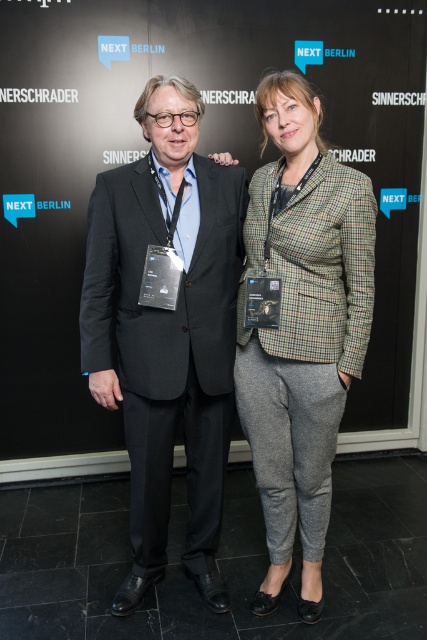
Based on the photo, who is higher up, dark gray suit at center or plaid wool blazer at center?

plaid wool blazer at center is above.

Is point (222, 472) closer to camera compared to point (313, 564)?

That is False.

Does point (187, 243) come closer to viewer compared to point (368, 196)?

No, it is not.

Where is `dark gray suit at center`? The width and height of the screenshot is (427, 640). dark gray suit at center is located at coordinates (166, 330).

Is point (322, 13) positioned in front of point (272, 444)?

No.

Does black fabric at center have a greater width compared to plaid wool blazer at center?

Yes.

This screenshot has width=427, height=640. What do you see at coordinates (201, 154) in the screenshot?
I see `black fabric at center` at bounding box center [201, 154].

Image resolution: width=427 pixels, height=640 pixels. What are the coordinates of `black fabric at center` in the screenshot? It's located at (201, 154).

Between black fabric at center and dark gray suit at center, which one has less height?

dark gray suit at center is shorter.

Is black fabric at center bigger than dark gray suit at center?

Correct, black fabric at center is larger in size than dark gray suit at center.

The image size is (427, 640). I want to click on black fabric at center, so click(x=201, y=154).